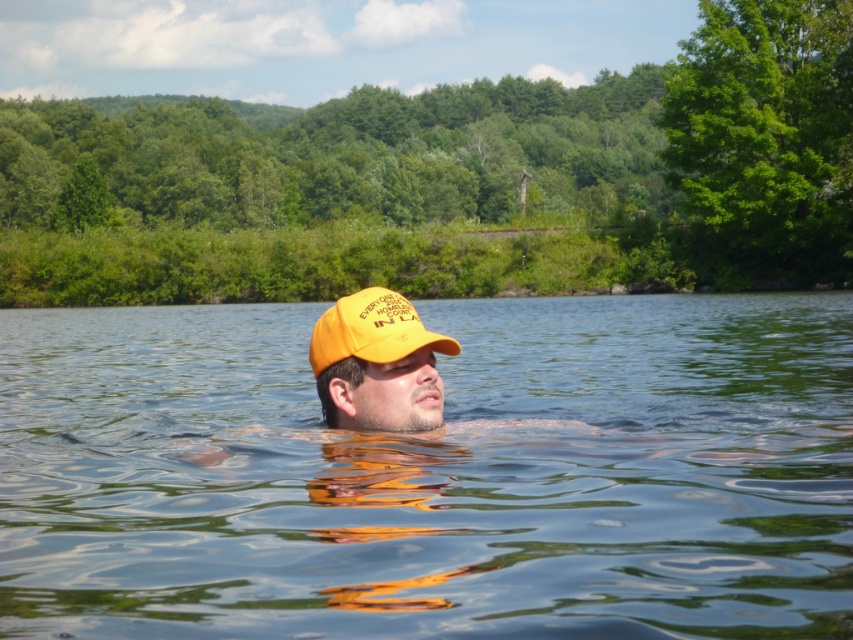
You are a drone operator trying to capture a photo of the person swimming in the lake. The drone is currently at point A, which is at the same height as the transparent water at center. To get the best shot, you need to move the drone to point B, which is 0.2 units higher than point A. What coordinate should the drone be moved to?

The transparent water at center is located at point (432, 474). To move the drone 0.2 units higher, adjust the y coordinate by adding 0.2, resulting in the new position at point (602, 474).

From the picture: You are a photographer trying to capture the yellow matte baseball cap at center in the image. Since the transparent water at center is between you and the cap, will the cap be fully visible in your photo?

The transparent water at center is much taller than the yellow matte baseball cap at center, so the cap will not be fully visible in the photo because the water is blocking part of it.

You are a photographer trying to capture the reflection of the yellow matte baseball cap at center in the transparent water at center. Given the size difference between them, do you think the reflection will be larger or smaller than the actual cap?

The transparent water at center has a larger size compared to yellow matte baseball cap at center. Since reflections typically mirror the object, the reflection of the yellow matte baseball cap at center in the transparent water at center will be smaller than the actual cap.